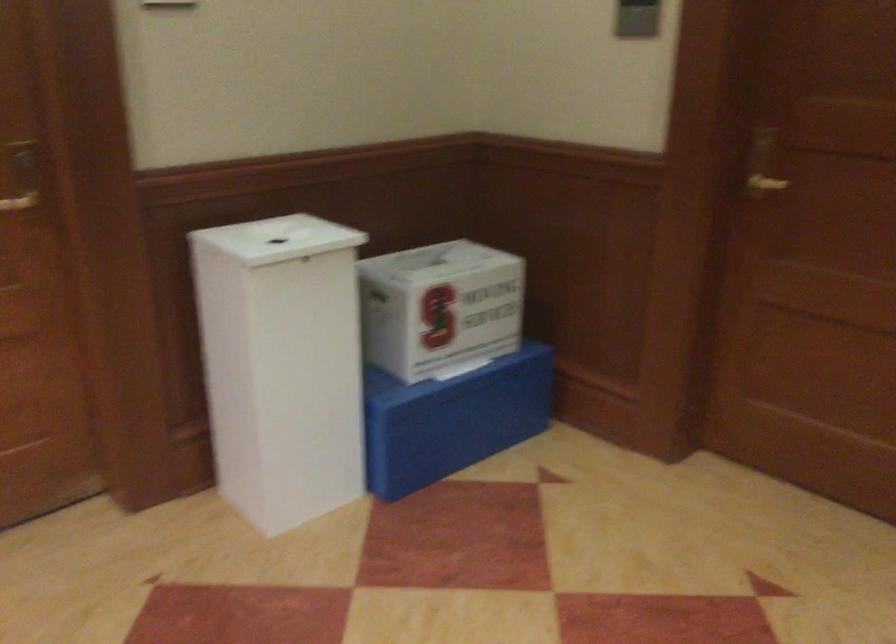
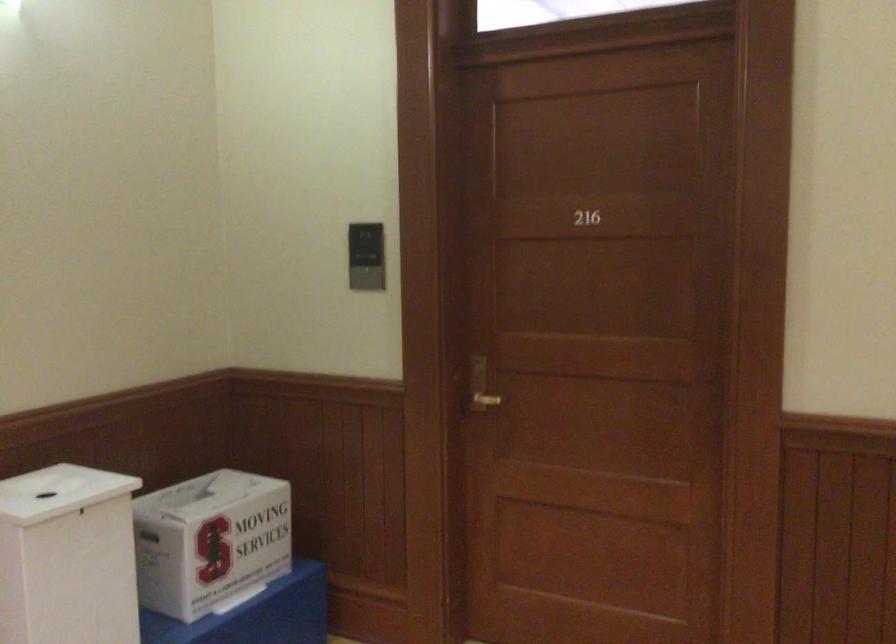
The images are taken continuously from a first-person perspective. In which direction are you moving?

The cameraman walked toward left, backward.